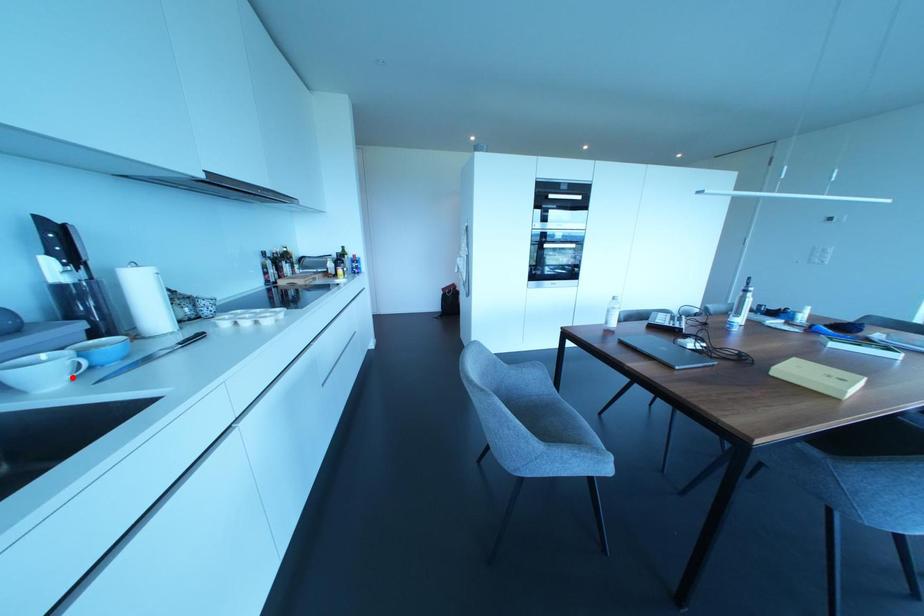
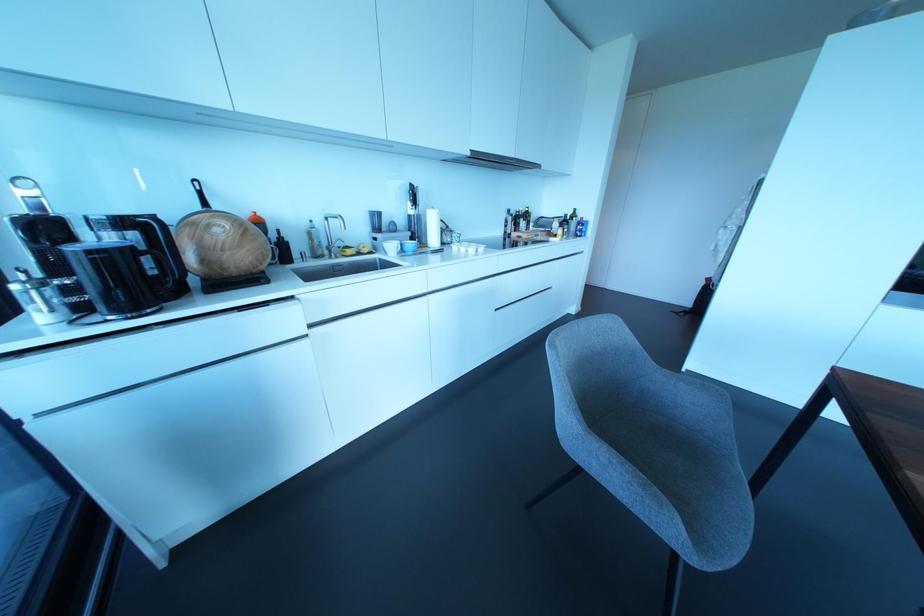
Find the pixel in the second image that matches the highlighted location in the first image.

(397, 253)